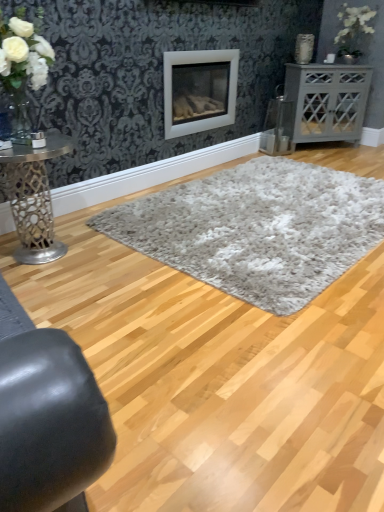
Question: Is white fluffy rug at center, which is counted as the 1th plain, starting from the back, bigger or smaller than gray matte cabinet at right, arranged as the second table when ordered from the bottom?

Choices:
 (A) big
 (B) small

Answer: (A)

Question: Considering the relative positions of white fluffy rug at center, which is counted as the 1th plain, starting from the back, and gray matte cabinet at right, positioned as the 1th table in right-to-left order, in the image provided, is white fluffy rug at center, which is counted as the 1th plain, starting from the back, to the left or to the right of gray matte cabinet at right, positioned as the 1th table in right-to-left order,?

Choices:
 (A) right
 (B) left

Answer: (B)

Question: Which of these objects is positioned closest to the white shag rug at center, which is the second plain from back to front?

Choices:
 (A) gray matte cabinet at right, marked as the second table in a left-to-right arrangement
 (B) metallic silver table at left, acting as the second table starting from the top
 (C) white fluffy rug at center, which is counted as the 1th plain, starting from the back
 (D) white matte wood burning stove at center

Answer: (C)

Question: Which object is positioned farthest from the metallic silver table at left, acting as the second table starting from the top?

Choices:
 (A) white shag rug at center, the 1th plain in the front-to-back sequence
 (B) white fluffy rug at center, the second plain from the front
 (C) gray matte cabinet at right, positioned as the 1th table in right-to-left order
 (D) white matte wood burning stove at center

Answer: (C)